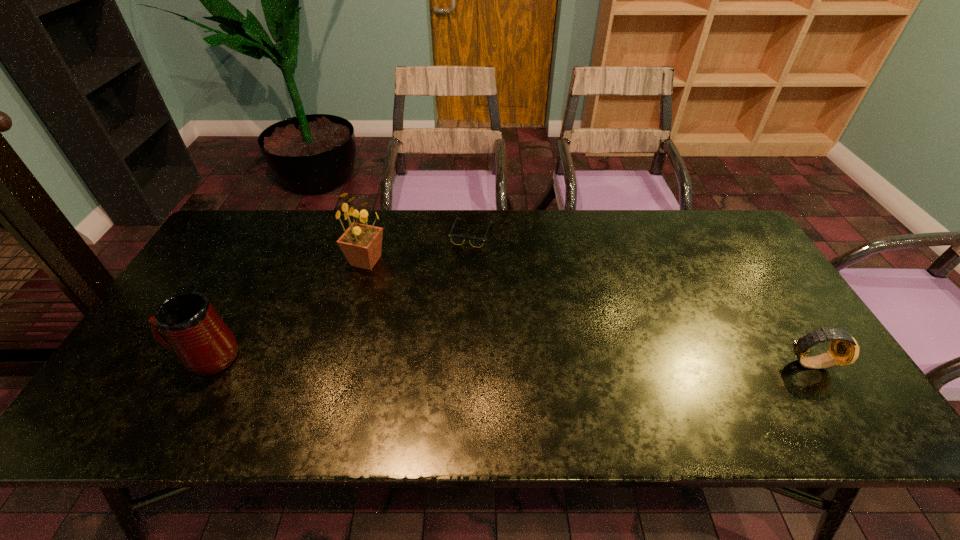
Locate an element on the screen. Image resolution: width=960 pixels, height=540 pixels. mug is located at coordinates (186, 323).

At what (x,y) coordinates should I click in order to perform the action: click on the second tallest object. Please return your answer as a coordinate pair (x, y). The image size is (960, 540). Looking at the image, I should click on (186, 323).

Image resolution: width=960 pixels, height=540 pixels. What are the coordinates of `the third tallest object` in the screenshot? It's located at (844, 350).

Where is `the rightmost object`? the rightmost object is located at coordinates (844, 350).

Where is `the shortest object`? The height and width of the screenshot is (540, 960). the shortest object is located at coordinates (456, 239).

Identify the location of sunglasses. This screenshot has height=540, width=960. (456, 239).

Identify the location of the tallest object. The width and height of the screenshot is (960, 540). pos(361,243).

Locate an element on the screen. The height and width of the screenshot is (540, 960). the second object from left to right is located at coordinates pyautogui.click(x=361, y=243).

Where is `blank space located on the lenses of the shortest object`? blank space located on the lenses of the shortest object is located at coordinates tap(515, 342).

The height and width of the screenshot is (540, 960). In order to click on vacant space located 0.320m on the lenses of the shortest object in this screenshot , I will do `click(508, 324)`.